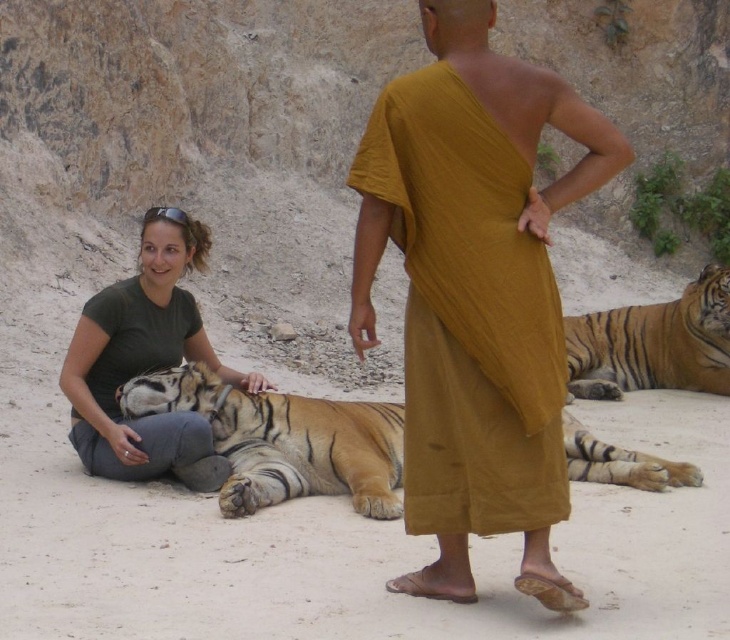
Does point (318, 403) come farther from viewer compared to point (155, 314)?

Yes.

Which of these two, orange-brown fur tiger at center or green matte shirt at lower left, stands taller?

green matte shirt at lower left

Which is in front, point (299, 449) or point (166, 419)?

Positioned in front is point (166, 419).

The image size is (730, 640). Find the location of `orange-brown fur tiger at center`. orange-brown fur tiger at center is located at coordinates (284, 440).

Is orange-brown fur tiger at center taller than orange striped tiger at lower right?

No, orange-brown fur tiger at center is not taller than orange striped tiger at lower right.

This screenshot has width=730, height=640. I want to click on orange-brown fur tiger at center, so click(284, 440).

Image resolution: width=730 pixels, height=640 pixels. I want to click on orange-brown fur tiger at center, so (284, 440).

Is mustard fabric robe at center below green matte shirt at lower left?

Actually, mustard fabric robe at center is above green matte shirt at lower left.

Who is taller, mustard fabric robe at center or green matte shirt at lower left?

green matte shirt at lower left

Describe the element at coordinates (474, 291) in the screenshot. I see `mustard fabric robe at center` at that location.

Identify the location of mustard fabric robe at center. Image resolution: width=730 pixels, height=640 pixels. (474, 291).